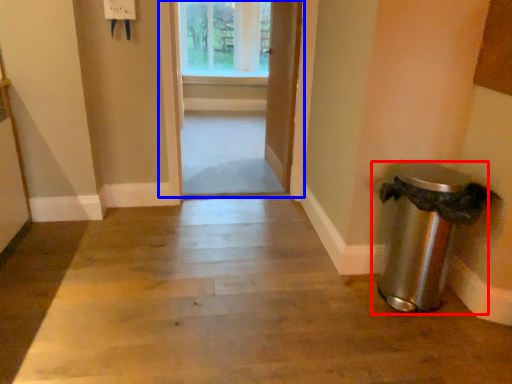
Question: Among these objects, which one is farthest to the camera, waste container (highlighted by a red box) or door (highlighted by a blue box)?

Choices:
 (A) waste container
 (B) door

Answer: (B)